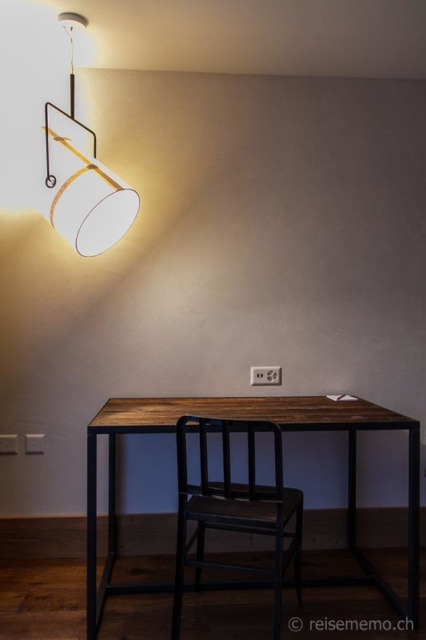
You are sitting at the table and want to grab the matte white lampshade at upper left. Which direction should you turn to face the black matte chair at center?

Since the black matte chair at center is to the right of the matte white lampshade at upper left, you should turn to your left to face the black matte chair at center.

You are organizing a dinner party and need to ensure the rustic wood table at center is properly lit. Since the matte white lampshade at upper left is the only light source, can you confirm if the lamp is positioned above the table to provide adequate lighting?

The rustic wood table at center is located below the matte white lampshade at upper left, so yes, the lamp is positioned above the table to provide adequate lighting.